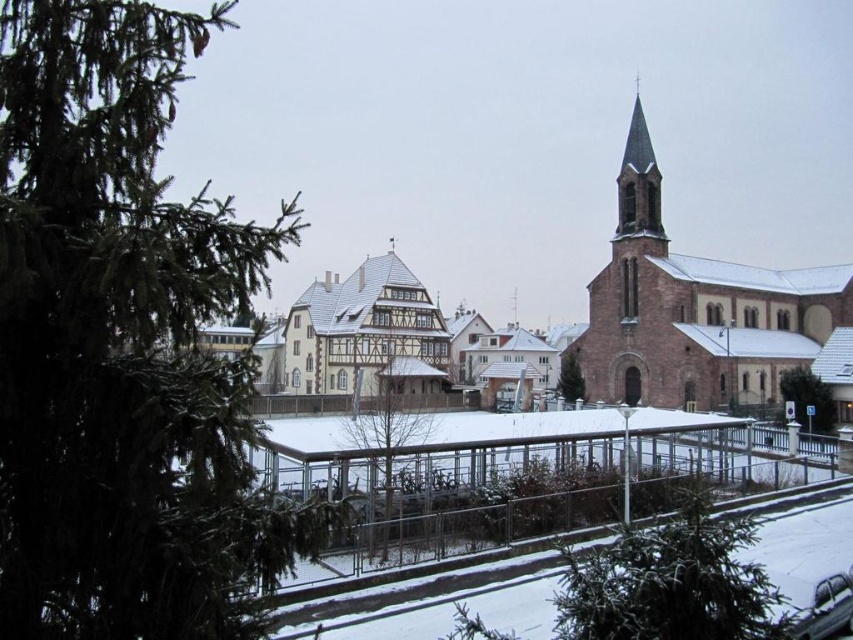
Question: Is green textured tree at lower center closer to camera compared to wooden timber frame house at center?

Choices:
 (A) no
 (B) yes

Answer: (B)

Question: Is wooden timber frame house at center below green matte tree at lower right?

Choices:
 (A) yes
 (B) no

Answer: (B)

Question: Which point appears farthest from the camera in this image?

Choices:
 (A) (418, 291)
 (B) (560, 364)
 (C) (635, 276)
 (D) (151, 419)

Answer: (B)

Question: Which is nearer to the brown wooden tree at center?

Choices:
 (A) green needle-like tree at left
 (B) red brick church at upper right
 (C) green matte tree at lower right

Answer: (A)

Question: Among these objects, which one is farthest from the camera?

Choices:
 (A) green textured pine tree at center
 (B) clear glass fence at center
 (C) green needle-like tree at left

Answer: (A)

Question: Is clear glass fence at center positioned in front of brown wooden tree at center?

Choices:
 (A) no
 (B) yes

Answer: (B)